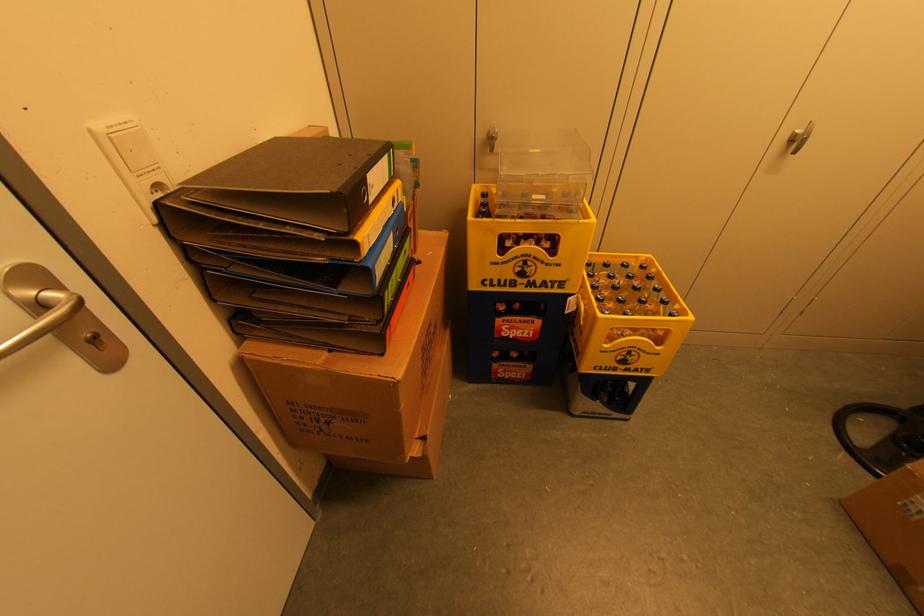
Find where to lift the blue ring binder. Please return your answer as a coordinate pair (x, y).

(290, 213)